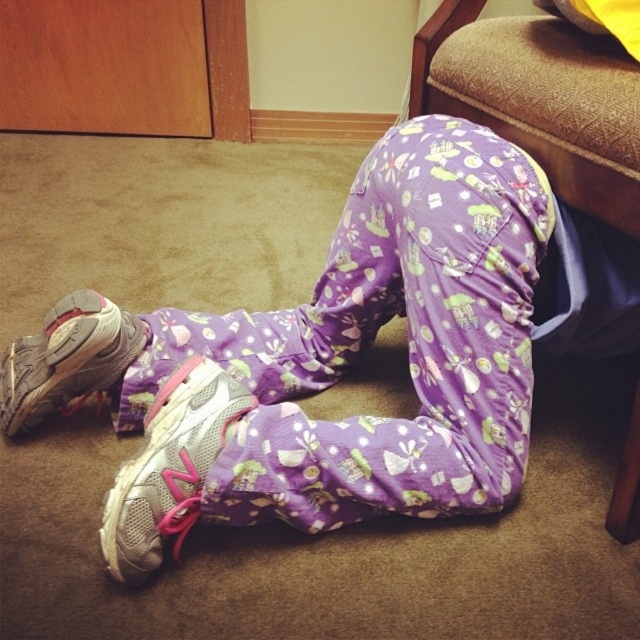
Based on the photo, who is positioned more to the right, silver mesh shoe at lower left or brown fabric chair at lower right?

brown fabric chair at lower right

Between silver mesh shoe at lower left and brown fabric chair at lower right, which one appears on the left side from the viewer's perspective?

silver mesh shoe at lower left is more to the left.

Identify the location of silver mesh shoe at lower left. (168, 467).

Which is more to the left, brown fabric chair at lower right or silver mesh sneaker at lower left?

From the viewer's perspective, silver mesh sneaker at lower left appears more on the left side.

Does brown fabric chair at lower right have a greater height compared to silver mesh sneaker at lower left?

Yes, brown fabric chair at lower right is taller than silver mesh sneaker at lower left.

Which is behind, point (616, 93) or point (65, 339)?

Point (65, 339)

Where is `brown fabric chair at lower right`? brown fabric chair at lower right is located at coordinates (522, 129).

You are a GUI agent. You are given a task and a screenshot of the screen. Output one action in this format:
    pyautogui.click(x=<x>, y=<y>)
    Task: Click on the purple cotton pants at lower center
    The height and width of the screenshot is (640, 640).
    Given the screenshot: What is the action you would take?
    pyautogui.click(x=346, y=355)

Is point (422, 388) closer to viewer compared to point (157, 556)?

No, it is behind (157, 556).

Locate an element on the screen. This screenshot has height=640, width=640. purple cotton pants at lower center is located at coordinates (346, 355).